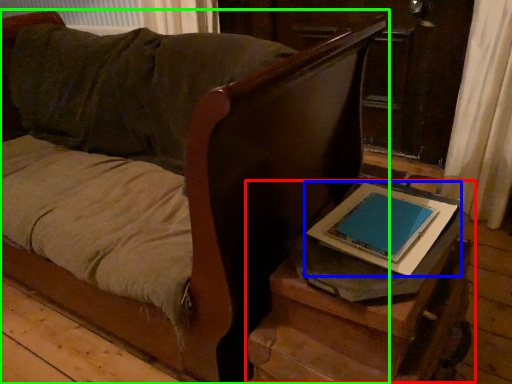
Question: Which object is positioned closest to table (highlighted by a red box)? Select from tablet computer (highlighted by a blue box) and furniture (highlighted by a green box).

Choices:
 (A) tablet computer
 (B) furniture

Answer: (A)